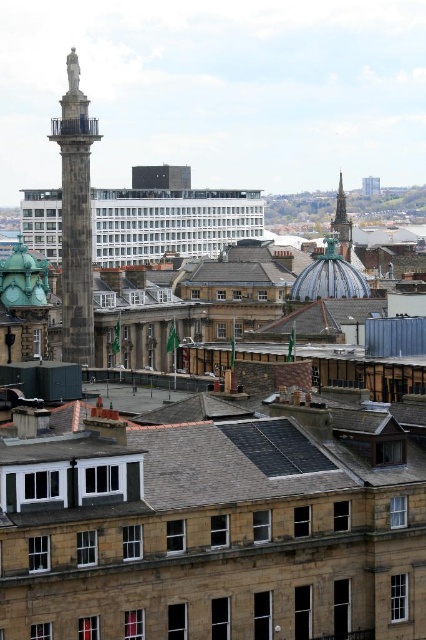
Question: Does dark gray slate roof at center have a larger size compared to dark gray stone column at upper left?

Choices:
 (A) yes
 (B) no

Answer: (B)

Question: Which point is closer to the camera?

Choices:
 (A) dark gray slate roof at center
 (B) dark gray stone column at upper left

Answer: (A)

Question: Among these points, which one is nearest to the camera?

Choices:
 (A) click(26, 483)
 (B) click(89, 358)

Answer: (A)

Question: Considering the relative positions of dark gray slate roof at center and dark gray stone column at upper left in the image provided, where is dark gray slate roof at center located with respect to dark gray stone column at upper left?

Choices:
 (A) below
 (B) above

Answer: (A)

Question: From the image, what is the correct spatial relationship of dark gray slate roof at center in relation to dark gray stone column at upper left?

Choices:
 (A) right
 (B) left

Answer: (A)